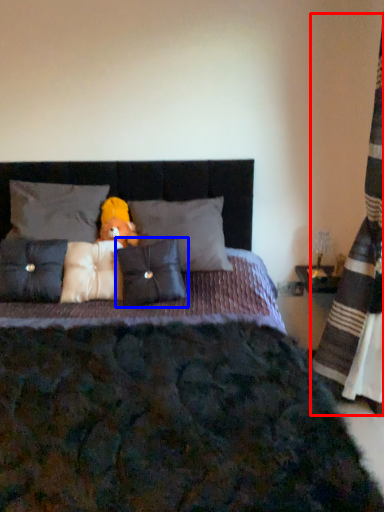
Question: Which object appears farthest to the camera in this image, curtain (highlighted by a red box) or pillow (highlighted by a blue box)?

Choices:
 (A) curtain
 (B) pillow

Answer: (B)